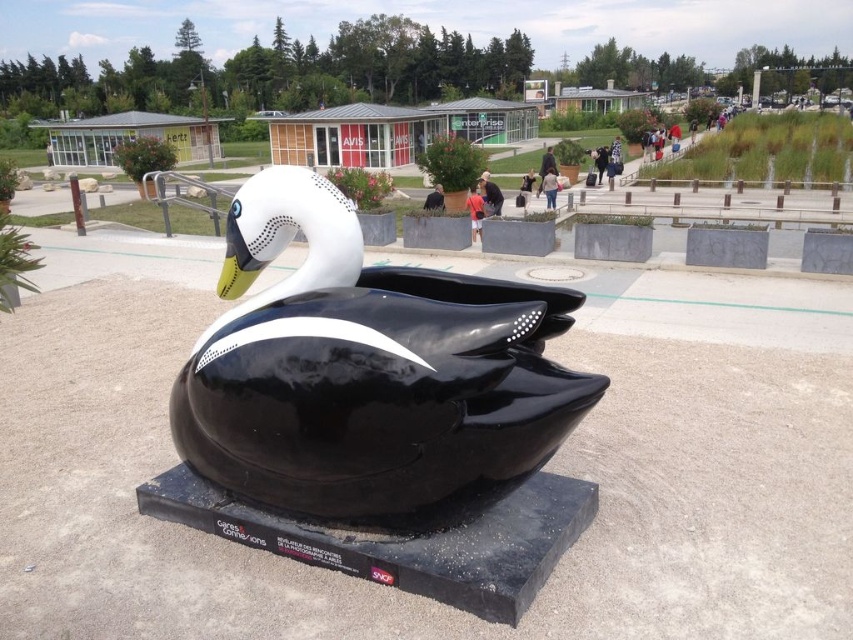
Question: Which is farther from the black matte jacket at center?

Choices:
 (A) matte black jacket at center
 (B) black fabric jacket at center

Answer: (A)

Question: Which object is positioned closest to the black fabric jacket at center?

Choices:
 (A) glossy black duck at center
 (B) light beige sweater at center
 (C) matte black jacket at center

Answer: (C)

Question: Does glossy black duck at center have a greater width compared to matte black jacket at center?

Choices:
 (A) yes
 (B) no

Answer: (A)

Question: Does glossy black duck at center appear on the left side of black matte jacket at center?

Choices:
 (A) no
 (B) yes

Answer: (B)

Question: Which of these objects is positioned farthest from the black fabric jacket at center?

Choices:
 (A) glossy black duck at center
 (B) matte black jacket at center
 (C) black matte jacket at center

Answer: (A)

Question: Can you confirm if glossy black duck at center is smaller than light beige sweater at center?

Choices:
 (A) yes
 (B) no

Answer: (B)